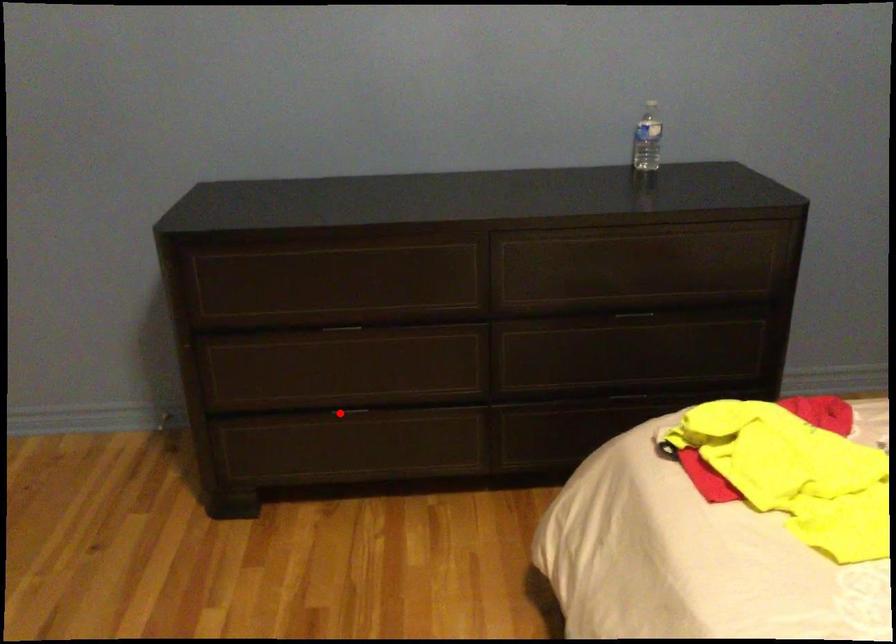
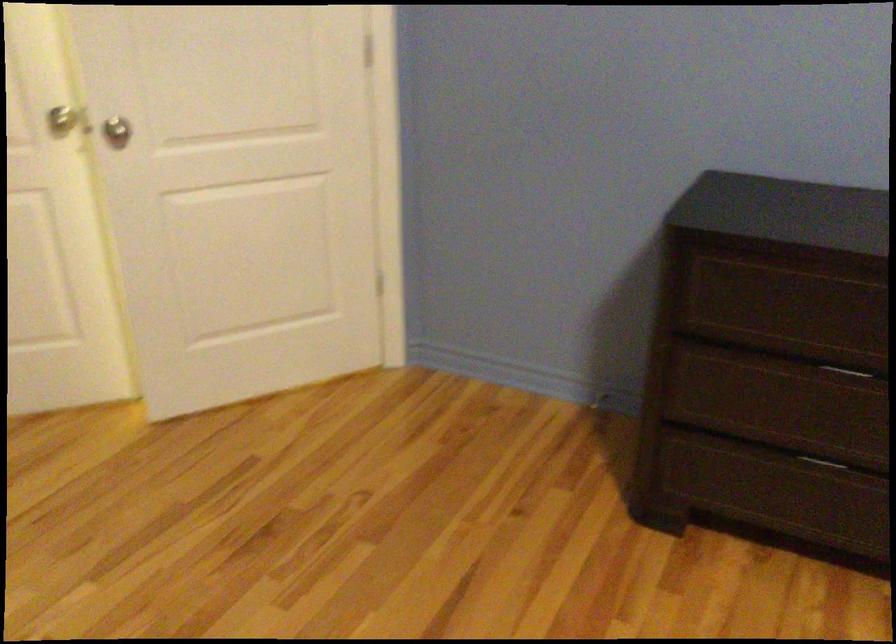
Find the pixel in the second image that matches the highlighted location in the first image.

(821, 462)